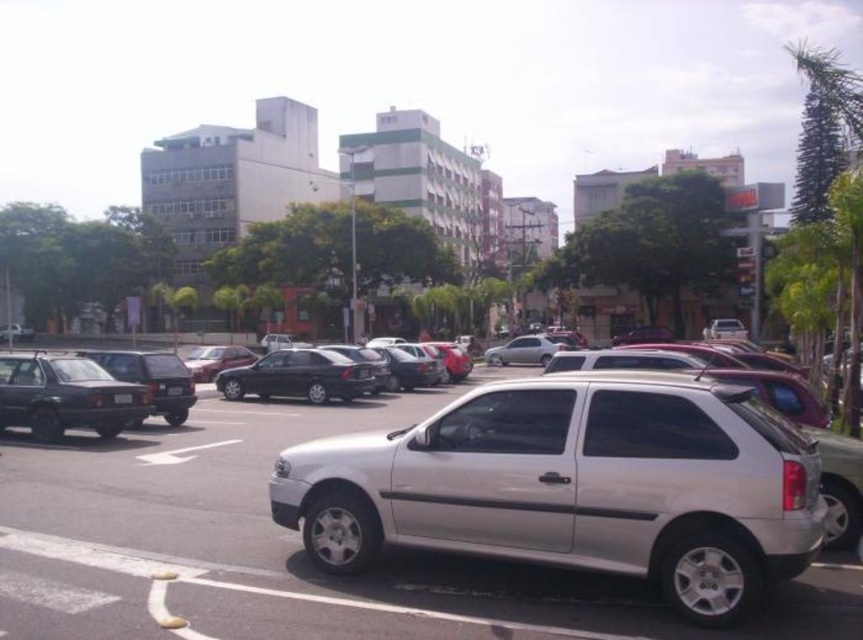
Question: Based on their relative distances, which object is nearer to the matte black sedan at left?

Choices:
 (A) white plastic license plate at center
 (B) shiny silver sedan at center

Answer: (A)

Question: Can you confirm if shiny silver sedan at center is wider than white plastic license plate at center?

Choices:
 (A) yes
 (B) no

Answer: (A)

Question: Is silver metallic hatchback at center further to the viewer compared to black plastic license plate at center?

Choices:
 (A) no
 (B) yes

Answer: (A)

Question: Which point is farther to the camera?

Choices:
 (A) (147, 369)
 (B) (211, 378)
 (C) (115, 396)

Answer: (B)

Question: Is satin black sedan at center positioned before satin silver sedan at center?

Choices:
 (A) yes
 (B) no

Answer: (A)

Question: Which of these objects is positioned farthest from the satin black sedan at center?

Choices:
 (A) shiny silver sedan at center
 (B) matte black sedan at left
 (C) white plastic license plate at center

Answer: (A)